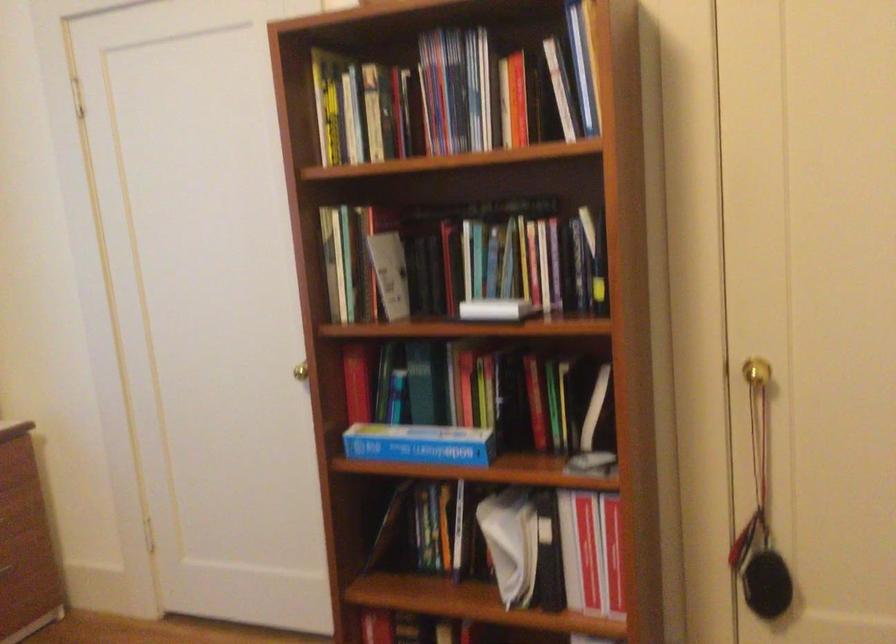
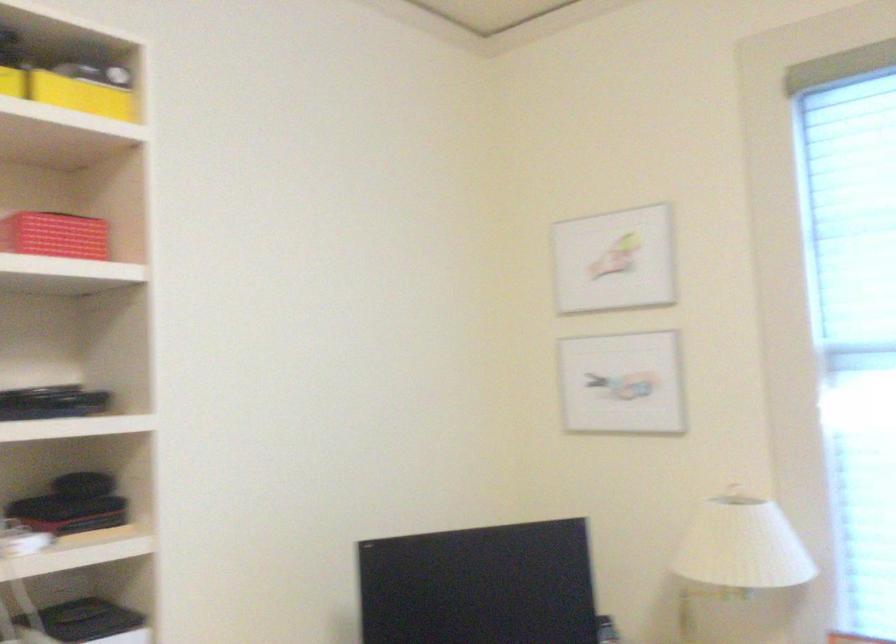
Question: The camera is either moving clockwise (left) or counter-clockwise (right) around the object. The first image is from the beginning of the video and the second image is from the end. Is the camera moving left or right when shooting the video?

Choices:
 (A) Left
 (B) Right

Answer: (B)